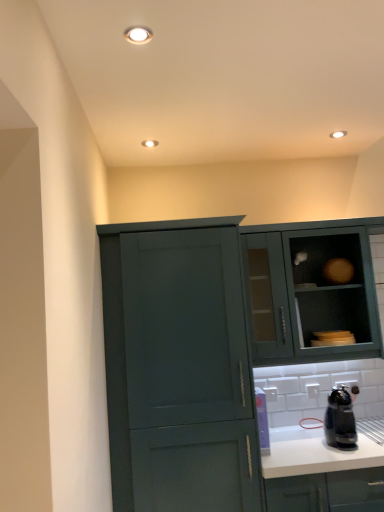
Question: Is matte teal cabinet at upper right, the second cabinetry positioned from the left, shorter than matte teal cabinet at center-left, arranged as the 1th cabinetry when viewed from the left?

Choices:
 (A) yes
 (B) no

Answer: (A)

Question: Does matte teal cabinet at upper right, arranged as the 1th cabinetry when viewed from the right, contain matte teal cabinet at center-left, which is the second cabinetry from right to left?

Choices:
 (A) yes
 (B) no

Answer: (B)

Question: Does matte teal cabinet at upper right, arranged as the 1th cabinetry when viewed from the right, turn towards matte teal cabinet at center-left, which is the second cabinetry from right to left?

Choices:
 (A) no
 (B) yes

Answer: (A)

Question: Can you confirm if matte teal cabinet at upper right, the second cabinetry positioned from the left, is positioned to the right of matte teal cabinet at center-left, which is the second cabinetry from right to left?

Choices:
 (A) no
 (B) yes

Answer: (B)

Question: From a real-world perspective, is matte teal cabinet at upper right, the second cabinetry positioned from the left, located higher than matte teal cabinet at center-left, which is the second cabinetry from right to left?

Choices:
 (A) yes
 (B) no

Answer: (A)

Question: Is matte teal cabinet at upper right, arranged as the 1th cabinetry when viewed from the right, to the left of matte teal cabinet at center-left, which is the second cabinetry from right to left, from the viewer's perspective?

Choices:
 (A) no
 (B) yes

Answer: (A)

Question: Considering the relative sizes of white matte countertop at lower right and matte teal cabinet at center-left, which is the second cabinetry from right to left, in the image provided, is white matte countertop at lower right wider than matte teal cabinet at center-left, which is the second cabinetry from right to left,?

Choices:
 (A) yes
 (B) no

Answer: (A)

Question: Does white matte countertop at lower right have a lesser width compared to matte teal cabinet at center-left, arranged as the 1th cabinetry when viewed from the left?

Choices:
 (A) yes
 (B) no

Answer: (B)

Question: From a real-world perspective, is white matte countertop at lower right under matte teal cabinet at center-left, arranged as the 1th cabinetry when viewed from the left?

Choices:
 (A) no
 (B) yes

Answer: (B)

Question: Is white matte countertop at lower right at the right side of matte teal cabinet at center-left, arranged as the 1th cabinetry when viewed from the left?

Choices:
 (A) no
 (B) yes

Answer: (B)

Question: Does white matte countertop at lower right lie in front of matte teal cabinet at center-left, arranged as the 1th cabinetry when viewed from the left?

Choices:
 (A) yes
 (B) no

Answer: (B)

Question: Is white matte countertop at lower right not close to matte teal cabinet at center-left, arranged as the 1th cabinetry when viewed from the left?

Choices:
 (A) no
 (B) yes

Answer: (A)

Question: Is matte teal cabinet at center-left, which is the second cabinetry from right to left, further to camera compared to black plastic coffee maker at lower right?

Choices:
 (A) no
 (B) yes

Answer: (A)